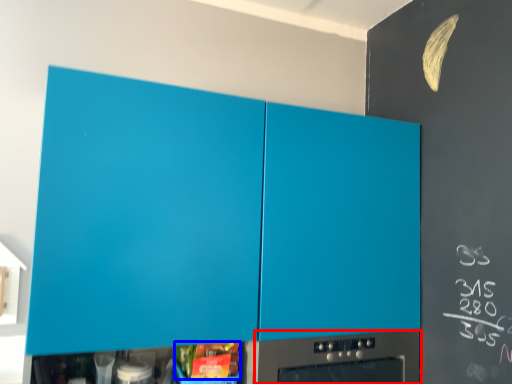
Question: Which object is closer to the camera taking this photo, home appliance (highlighted by a red box) or food (highlighted by a blue box)?

Choices:
 (A) home appliance
 (B) food

Answer: (B)